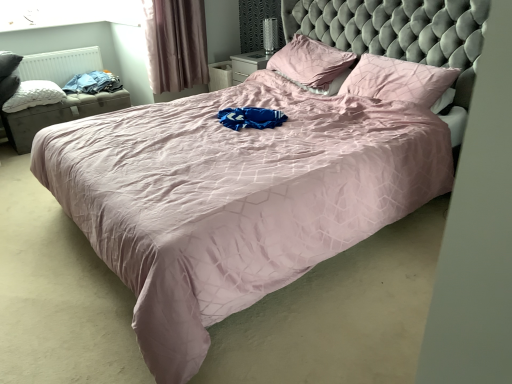
Question: In the image, is pink fabric curtain at upper left positioned in front of or behind white matte radiator at left?

Choices:
 (A) behind
 (B) front

Answer: (B)

Question: Considering the relative positions of pink fabric curtain at upper left and white matte radiator at left in the image provided, is pink fabric curtain at upper left to the left or to the right of white matte radiator at left?

Choices:
 (A) left
 (B) right

Answer: (B)

Question: Which object is the closest to the white quilted pillow at left, marked as the first pillow in a left-to-right arrangement?

Choices:
 (A) blue cotton shirt at left
 (B) matte gray storage ottoman at left
 (C) transparent glass window screen at upper left
 (D) pink fabric curtain at upper left
 (E) pink fabric pillow at center, arranged as the 2th pillow when viewed from the left

Answer: (B)

Question: Based on their relative distances, which object is nearer to the transparent glass window screen at upper left?

Choices:
 (A) white quilted pillow at left, marked as the first pillow in a left-to-right arrangement
 (B) pink fabric pillow at center, positioned as the second pillow in right-to-left order
 (C) blue cotton shirt at left
 (D) pink fabric curtain at upper left
 (E) white matte radiator at left

Answer: (E)